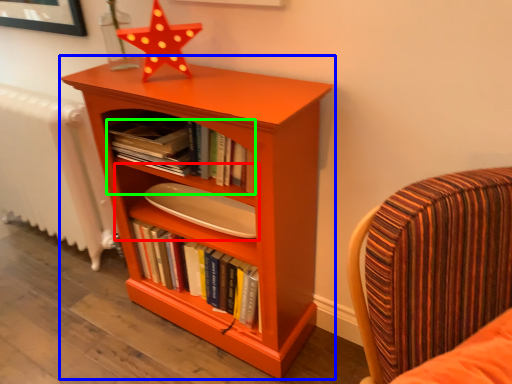
Question: Based on their relative distances, which object is nearer to shelf (highlighted by a red box)? Choose from bookcase (highlighted by a blue box) and book (highlighted by a green box).

Choices:
 (A) bookcase
 (B) book

Answer: (B)